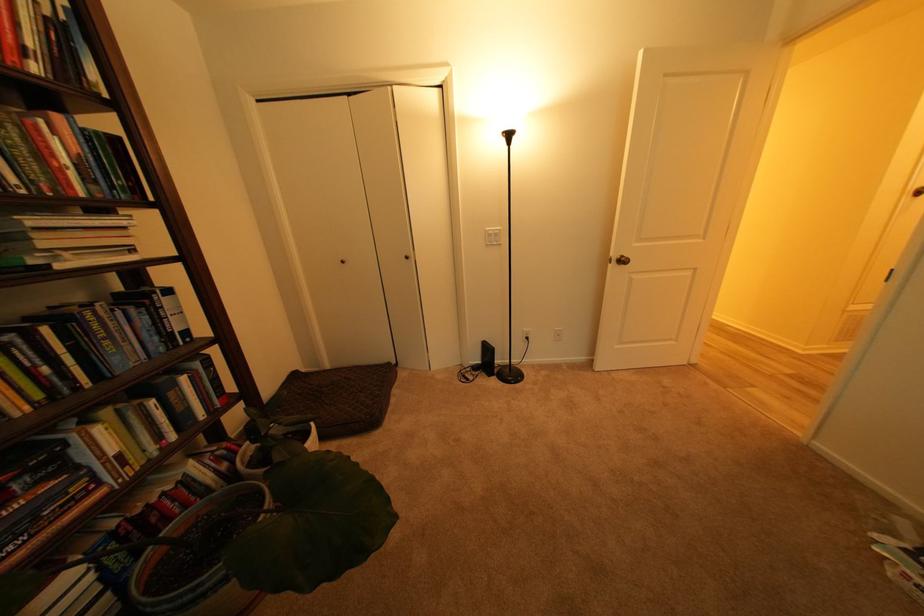
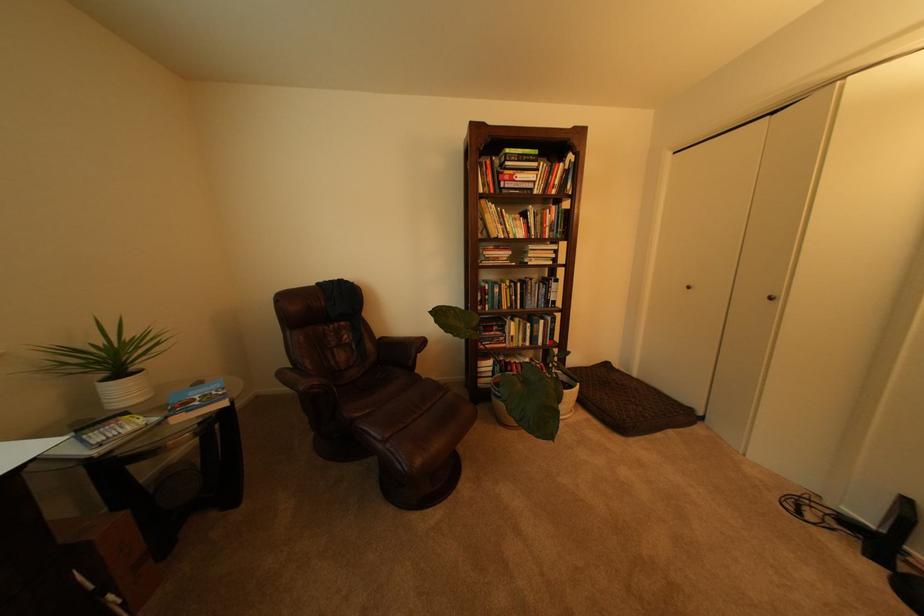
Locate, in the second image, the point that corresponds to the point at 418,259 in the first image.

(782, 300)